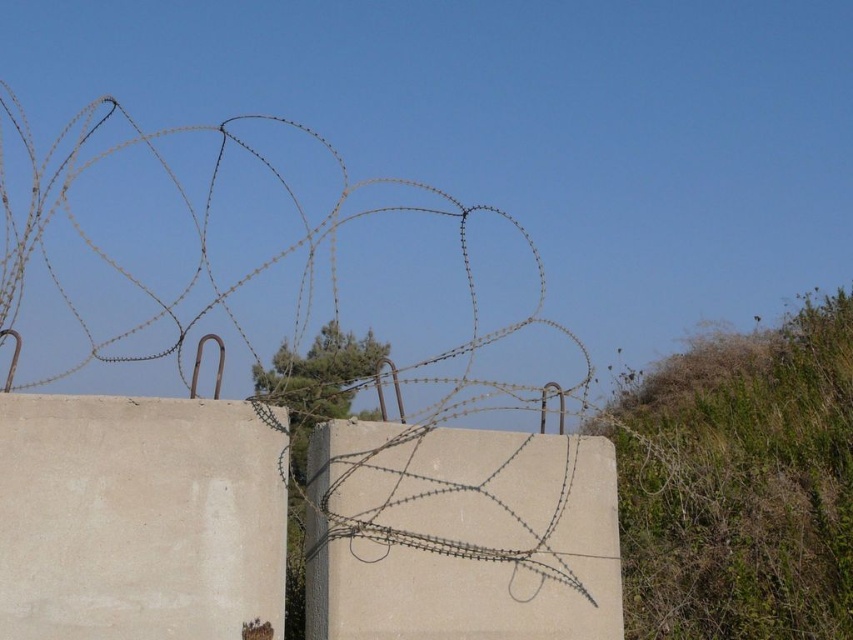
Question: Which is nearer to the beige concrete at center?

Choices:
 (A) brown wire at upper center
 (B) gray concrete at center

Answer: (B)

Question: Which object appears closest to the camera in this image?

Choices:
 (A) gray concrete at center
 (B) brown wire at upper center

Answer: (A)

Question: Can you confirm if beige concrete at center is positioned below gray concrete at center?

Choices:
 (A) yes
 (B) no

Answer: (B)

Question: Is gray concrete at center wider than brown wire at upper center?

Choices:
 (A) yes
 (B) no

Answer: (B)

Question: Which object is farther from the camera taking this photo?

Choices:
 (A) gray concrete at center
 (B) beige concrete at center
 (C) brown wire at upper center

Answer: (C)

Question: Does gray concrete at center appear over brown wire at upper center?

Choices:
 (A) yes
 (B) no

Answer: (B)